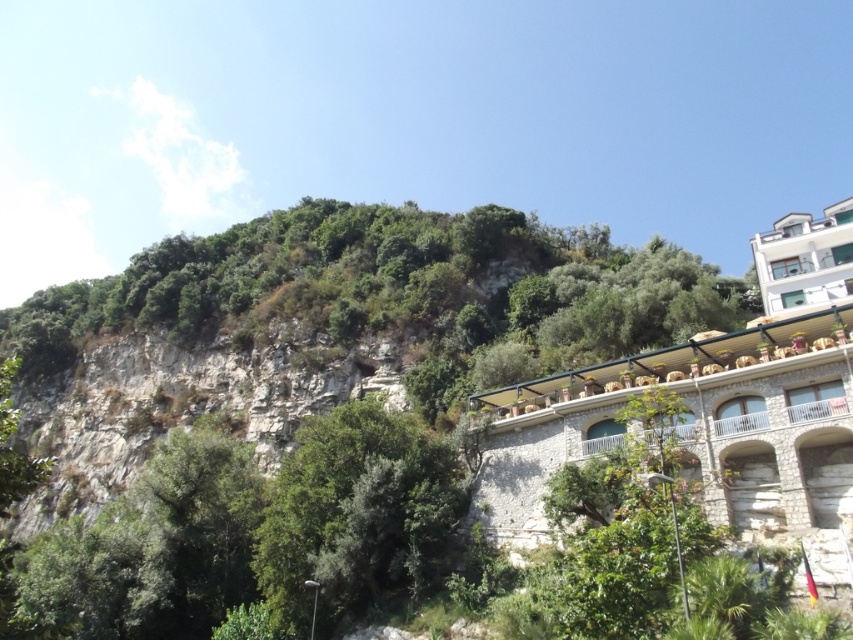
Question: Considering the relative positions of wooden balcony at upper right and white matte building at upper right in the image provided, where is wooden balcony at upper right located with respect to white matte building at upper right?

Choices:
 (A) left
 (B) right

Answer: (A)

Question: Estimate the real-world distances between objects in this image. Which object is farther from the white stone building at center-right?

Choices:
 (A) white stone balcony at center
 (B) wooden balcony at upper right
 (C) green leafy tree at upper center

Answer: (C)

Question: Among these objects, which one is nearest to the camera?

Choices:
 (A) wooden balcony at upper right
 (B) white stone building at center-right
 (C) green leafy tree at center
 (D) green leafy tree at upper center

Answer: (D)

Question: Among these points, which one is farthest from the camera?

Choices:
 (A) (717, 371)
 (B) (756, 413)
 (C) (432, 440)

Answer: (C)

Question: Is green leafy tree at upper center to the right of white matte building at upper right from the viewer's perspective?

Choices:
 (A) no
 (B) yes

Answer: (A)

Question: Is green leafy tree at upper center closer to the viewer compared to white stone building at center-right?

Choices:
 (A) no
 (B) yes

Answer: (B)